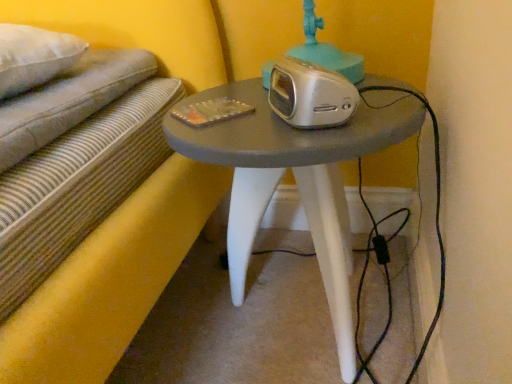
Locate an element on the screen. The width and height of the screenshot is (512, 384). vacant region to the left of silver metallic alarm clock at center is located at coordinates (229, 119).